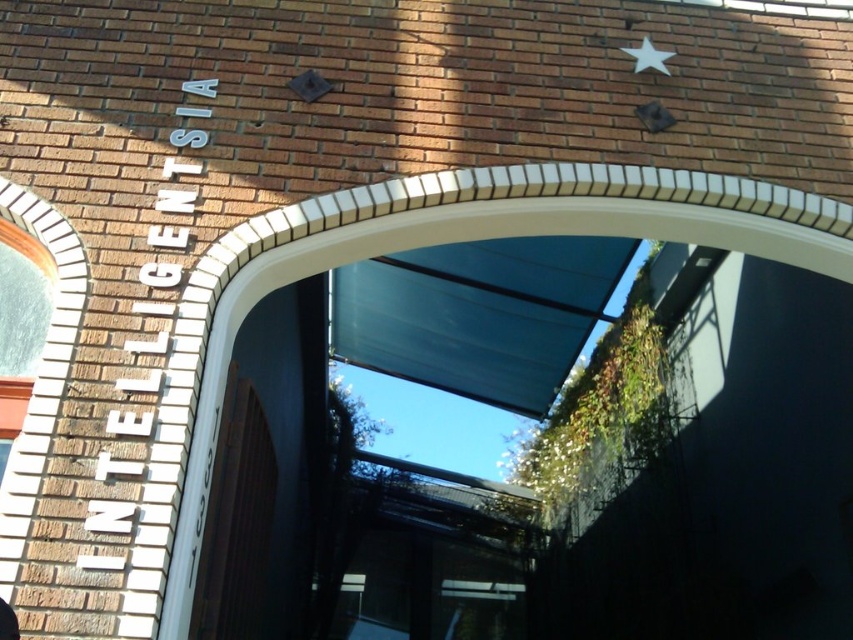
You are standing in front of the brick building with the arched opening. There are two points marked on the facade at coordinates point (596,225) and point (656,54). Which point is closer to you as you face the building?

Point (596,225) is in front of point (656,54), so it is closer to you as you face the building.

You are standing in front of the brick building and notice two white elements. One is the white brick archway at center and the other is the white matte star at upper right. Which of these two objects is positioned to the left of the other?

The white brick archway at center is positioned to the left of the white matte star at upper right.